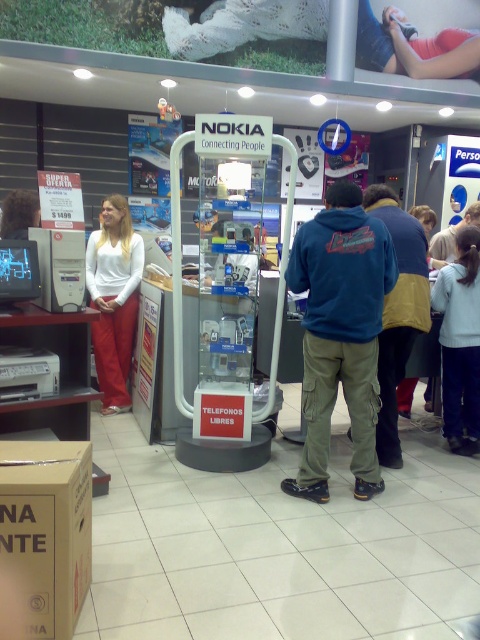
You are a delivery person who needs to place a package that is 2 meters long in the electronics store. The package must be placed between the brown cardboard box at lower left and the matte white blouse at center. Is there enough space for the package?

The brown cardboard box at lower left is 2.18 meters away from the matte white blouse at center, so yes, there is enough space to place the 2 meter long package between them.

You are a store employee who needs to place a new item in the brown cardboard box at lower left. However, there is a customer wearing a matte white blouse at center blocking your path. Based on the scene description, can you reach the box without moving the customer?

The brown cardboard box at lower left is to the right of the matte white blouse at center, so the employee can navigate around the customer by moving to the left side of the customer to access the box without needing to move them.

You are a customer in the store and want to pick up the brown cardboard box at lower left. Can you reach it without moving the matte white blouse at center?

The brown cardboard box at lower left has a lesser height compared to matte white blouse at center. Since the box is shorter, you can reach it without needing to move the blouse.